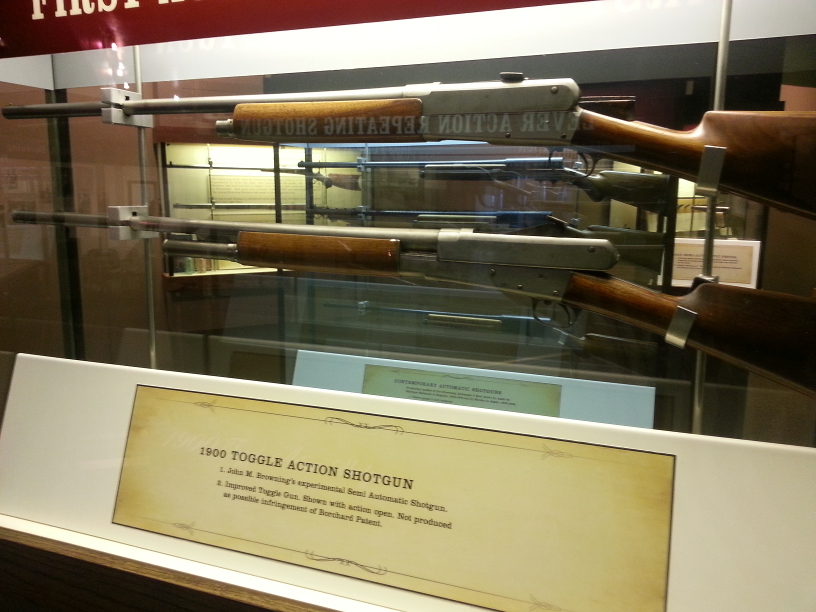
I want to click on glass, so click(x=486, y=62).